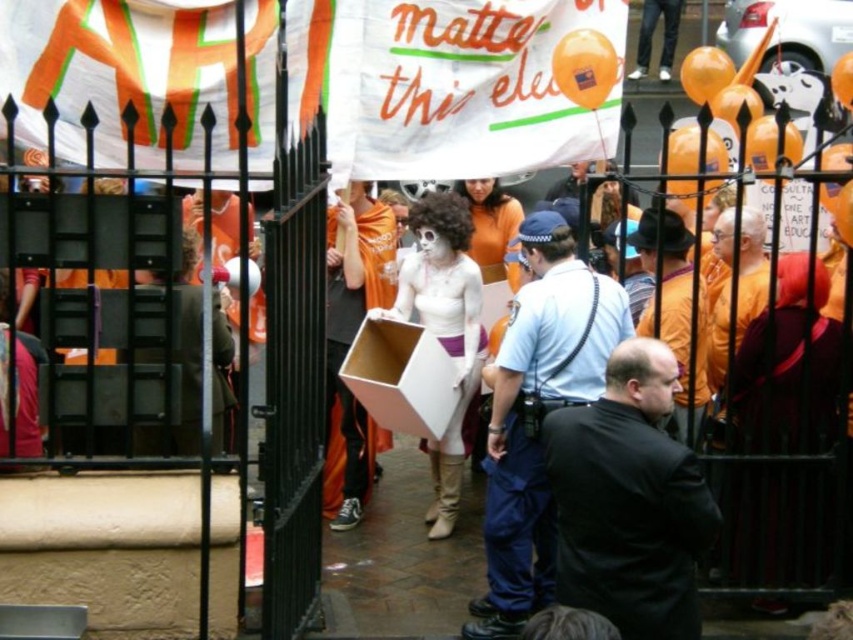
You are a photographer trying to capture both the black matte jacket at center and the dark blue uniform at center in a single frame. Based on their widths, which object should you position closer to the camera to ensure both fit within the frame?

The black matte jacket at center is narrower than the dark blue uniform at center. To ensure both fit in the frame, position the black matte jacket at center closer to the camera since it requires less space, allowing the wider dark blue uniform at center to occupy the background without overcrowding the composition.

You are a photographer trying to capture a clear shot of both the dark blue uniform at center and the orange fabric shirt at center. Given their sizes, which one should you focus on first to ensure it fits within your camera frame?

The dark blue uniform at center is larger in size than the orange fabric shirt at center, so you should focus on capturing the dark blue uniform at center first to ensure it fits within the camera frame before adjusting for the smaller orange fabric shirt at center.